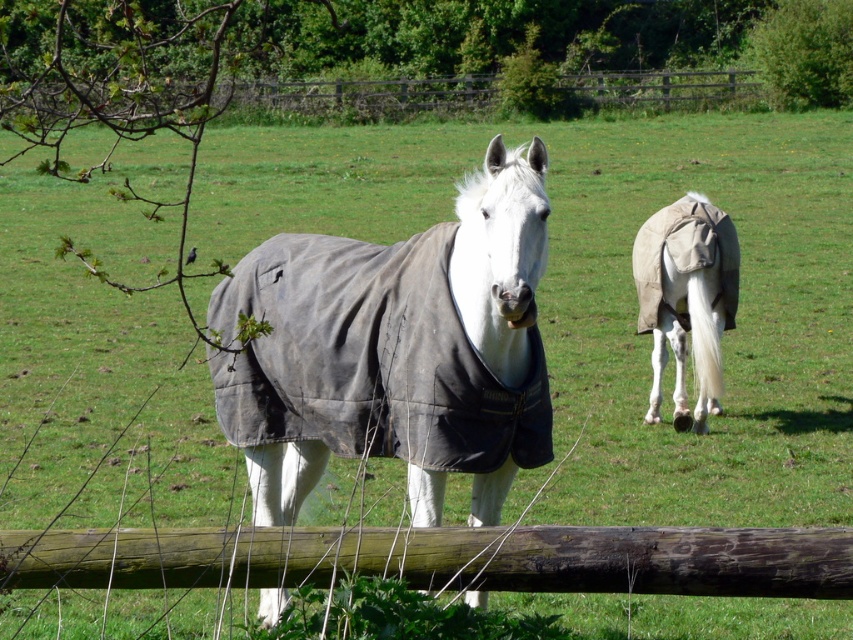
Based on the photo, you are a farmer who wants to ensure the white clothed horse at center can move freely around the wooden fence at upper center. Based on their sizes, do you think the horse has enough space to move around the fence without any issues?

The white clothed horse at center is smaller in size compared to the wooden fence at upper center. This means the horse should have sufficient space to move around the fence without any issues related to size constraints.